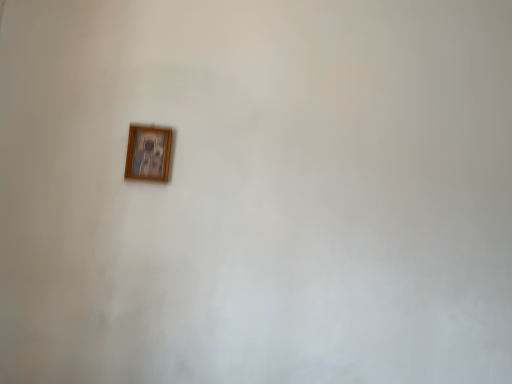
What do you see at coordinates (148, 153) in the screenshot? The image size is (512, 384). I see `wooden picture frame at upper center` at bounding box center [148, 153].

Locate an element on the screen. wooden picture frame at upper center is located at coordinates pyautogui.click(x=148, y=153).

Find the location of `wooden picture frame at upper center`. wooden picture frame at upper center is located at coordinates (148, 153).